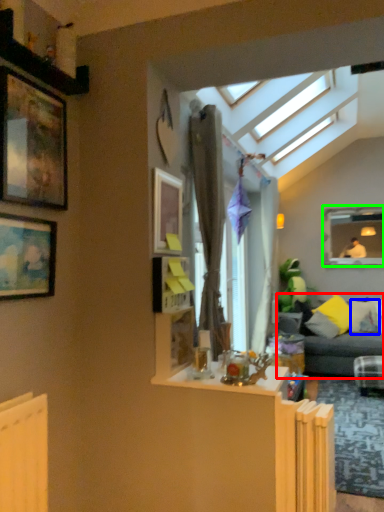
Question: Which object is the farthest from studio couch (highlighted by a red box)? Choose among these: pillow (highlighted by a blue box) or window frame (highlighted by a green box).

Choices:
 (A) pillow
 (B) window frame

Answer: (B)